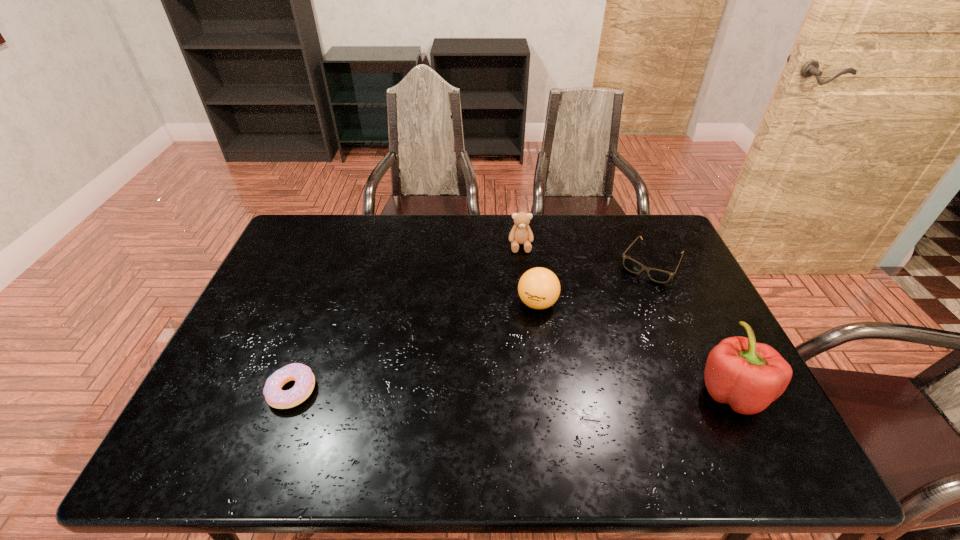
Identify the location of vacant space on the desktop that is between the doughnut and the bell pepper and is positioned on the lenses of the sunglasses. The image size is (960, 540). (570, 391).

Locate an element on the screen. free space on the desktop that is between the leftmost object and the bell pepper and is positioned on the front-facing side of the teddy bear is located at coordinates (534, 391).

I want to click on free spot on the desktop that is between the leftmost object and the bell pepper and is positioned on the side with brand of the ping-pong ball, so click(x=451, y=390).